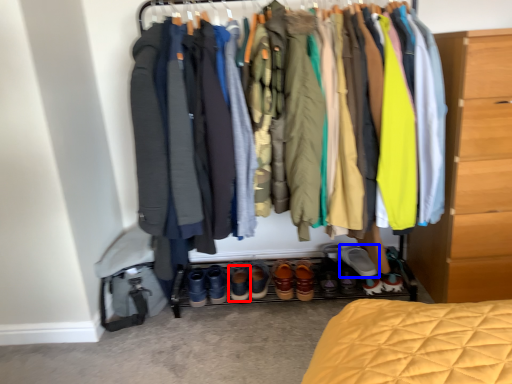
Question: Which of the following is the closest to the observer, footwear (highlighted by a red box) or footwear (highlighted by a blue box)?

Choices:
 (A) footwear
 (B) footwear

Answer: (B)